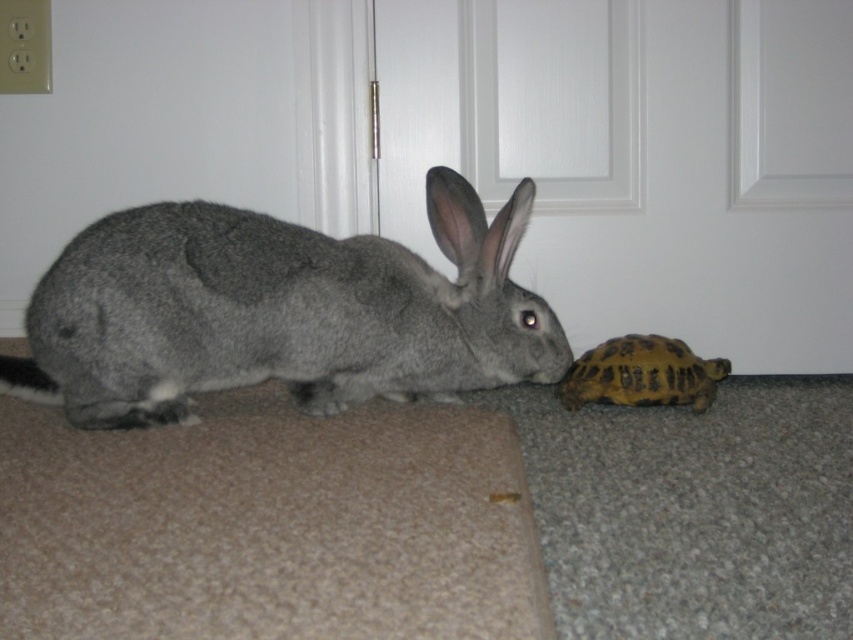
Question: Among these objects, which one is farthest from the camera?

Choices:
 (A) gray fur rabbit at left
 (B) yellow scaly tortoise at lower right

Answer: (B)

Question: Is gray fur rabbit at left smaller than yellow scaly tortoise at lower right?

Choices:
 (A) yes
 (B) no

Answer: (B)

Question: Considering the relative positions of gray fur rabbit at left and yellow scaly tortoise at lower right in the image provided, where is gray fur rabbit at left located with respect to yellow scaly tortoise at lower right?

Choices:
 (A) above
 (B) below

Answer: (A)

Question: Is gray fur rabbit at left to the left of yellow scaly tortoise at lower right from the viewer's perspective?

Choices:
 (A) no
 (B) yes

Answer: (B)